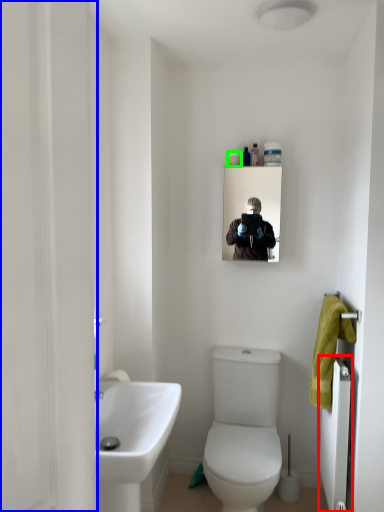
Question: Estimate the real-world distances between objects in this image. Which object is farther from radiator (highlighted by a red box), screen door (highlighted by a blue box) or toiletry (highlighted by a green box)?

Choices:
 (A) screen door
 (B) toiletry

Answer: (A)